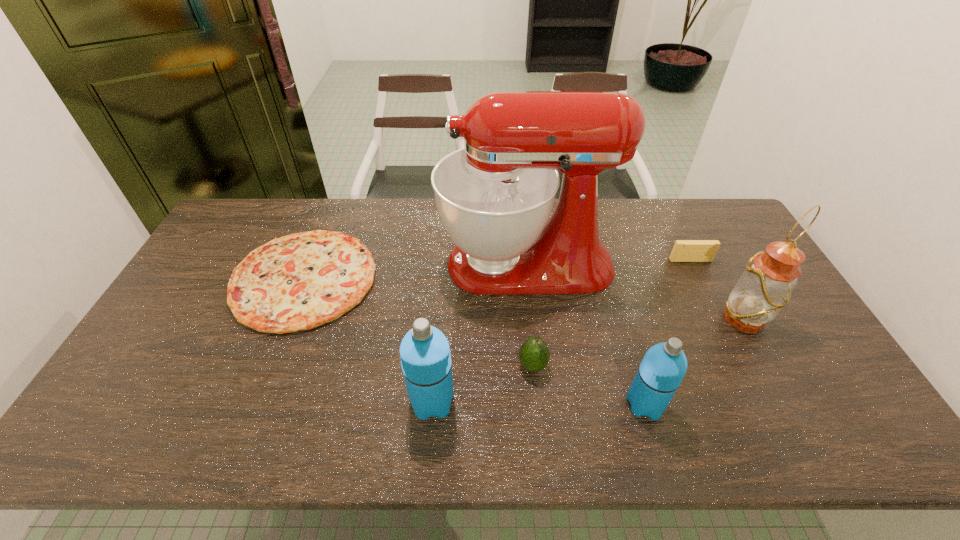
Locate an element on the screen. This screenshot has width=960, height=540. the left thermos bottle is located at coordinates (425, 356).

The width and height of the screenshot is (960, 540). Identify the location of the taller thermos bottle. (425, 356).

Locate an element on the screen. This screenshot has width=960, height=540. the shorter thermos bottle is located at coordinates (664, 365).

The width and height of the screenshot is (960, 540). What are the coordinates of `the right thermos bottle` in the screenshot? It's located at (664, 365).

In order to click on videotape in this screenshot , I will do `click(684, 250)`.

I want to click on the shortest object, so click(x=297, y=282).

Locate an element on the screen. The image size is (960, 540). the leftmost object is located at coordinates (297, 282).

Where is `mixer`? The image size is (960, 540). mixer is located at coordinates (495, 196).

Where is `the second tallest object`? This screenshot has width=960, height=540. the second tallest object is located at coordinates (765, 287).

The image size is (960, 540). Find the location of `avocado`. avocado is located at coordinates (534, 354).